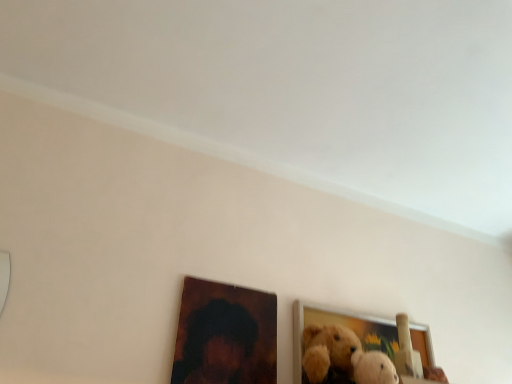
This screenshot has height=384, width=512. Describe the element at coordinates (225, 335) in the screenshot. I see `wooden picture frame at lower center, arranged as the first picture frame when viewed from the left` at that location.

Image resolution: width=512 pixels, height=384 pixels. What are the coordinates of `wooden picture frame at lower center, arranged as the first picture frame when viewed from the left` in the screenshot? It's located at (225, 335).

From the picture: What is the approximate width of wooden picture frame at lower right, positioned as the 2th picture frame in left-to-right order?

The width of wooden picture frame at lower right, positioned as the 2th picture frame in left-to-right order, is 4.57 centimeters.

Where is `wooden picture frame at lower right, positioned as the 2th picture frame in left-to-right order`? The image size is (512, 384). wooden picture frame at lower right, positioned as the 2th picture frame in left-to-right order is located at coordinates pos(338,339).

Based on the photo, measure the distance between wooden picture frame at lower right, positioned as the 2th picture frame in left-to-right order, and camera.

The distance of wooden picture frame at lower right, positioned as the 2th picture frame in left-to-right order, from camera is 35.41 inches.

What do you see at coordinates (338, 339) in the screenshot? The width and height of the screenshot is (512, 384). I see `wooden picture frame at lower right, positioned as the 2th picture frame in left-to-right order` at bounding box center [338, 339].

This screenshot has width=512, height=384. I want to click on wooden picture frame at lower center, the 2th picture frame when ordered from right to left, so click(x=225, y=335).

Is wooden picture frame at lower right, which is the 1th picture frame from right to left, at the right side of wooden picture frame at lower center, the 2th picture frame when ordered from right to left?

Yes.

Who is more distant, wooden picture frame at lower right, which is the 1th picture frame from right to left, or wooden picture frame at lower center, the 2th picture frame when ordered from right to left?

wooden picture frame at lower right, which is the 1th picture frame from right to left, is further away from the camera.

Considering the points (412, 335) and (210, 355), which point is behind, point (412, 335) or point (210, 355)?

The point (412, 335) is behind.

From the image's perspective, would you say wooden picture frame at lower right, positioned as the 2th picture frame in left-to-right order, is shown under wooden picture frame at lower center, arranged as the first picture frame when viewed from the left?

Indeed, from the image's perspective, wooden picture frame at lower right, positioned as the 2th picture frame in left-to-right order, is shown beneath wooden picture frame at lower center, arranged as the first picture frame when viewed from the left.

From a real-world perspective, is wooden picture frame at lower right, which is the 1th picture frame from right to left, positioned above or below wooden picture frame at lower center, arranged as the first picture frame when viewed from the left?

wooden picture frame at lower right, which is the 1th picture frame from right to left, is below wooden picture frame at lower center, arranged as the first picture frame when viewed from the left.

Is wooden picture frame at lower right, positioned as the 2th picture frame in left-to-right order, thinner than wooden picture frame at lower center, arranged as the first picture frame when viewed from the left?

Incorrect, the width of wooden picture frame at lower right, positioned as the 2th picture frame in left-to-right order, is not less than that of wooden picture frame at lower center, arranged as the first picture frame when viewed from the left.

Is wooden picture frame at lower right, which is the 1th picture frame from right to left, shorter than wooden picture frame at lower center, arranged as the first picture frame when viewed from the left?

Incorrect, the height of wooden picture frame at lower right, which is the 1th picture frame from right to left, does not fall short of that of wooden picture frame at lower center, arranged as the first picture frame when viewed from the left.

In the scene shown: Is wooden picture frame at lower right, positioned as the 2th picture frame in left-to-right order, bigger than wooden picture frame at lower center, arranged as the first picture frame when viewed from the left?

Correct, wooden picture frame at lower right, positioned as the 2th picture frame in left-to-right order, is larger in size than wooden picture frame at lower center, arranged as the first picture frame when viewed from the left.

In the scene shown: Is wooden picture frame at lower right, positioned as the 2th picture frame in left-to-right order, located outside wooden picture frame at lower center, the 2th picture frame when ordered from right to left?

Absolutely, wooden picture frame at lower right, positioned as the 2th picture frame in left-to-right order, is external to wooden picture frame at lower center, the 2th picture frame when ordered from right to left.

Can you see wooden picture frame at lower right, positioned as the 2th picture frame in left-to-right order, touching wooden picture frame at lower center, arranged as the first picture frame when viewed from the left?

There is a gap between wooden picture frame at lower right, positioned as the 2th picture frame in left-to-right order, and wooden picture frame at lower center, arranged as the first picture frame when viewed from the left.

Is wooden picture frame at lower right, positioned as the 2th picture frame in left-to-right order, oriented towards wooden picture frame at lower center, arranged as the first picture frame when viewed from the left?

No, wooden picture frame at lower right, positioned as the 2th picture frame in left-to-right order, is not turned towards wooden picture frame at lower center, arranged as the first picture frame when viewed from the left.

Can you tell me how much wooden picture frame at lower right, which is the 1th picture frame from right to left, and wooden picture frame at lower center, the 2th picture frame when ordered from right to left, differ in facing direction?

The angular difference between wooden picture frame at lower right, which is the 1th picture frame from right to left, and wooden picture frame at lower center, the 2th picture frame when ordered from right to left, is 1.1 degrees.

Where is `picture frame to the left of wooden picture frame at lower right, positioned as the 2th picture frame in left-to-right order`? The image size is (512, 384). picture frame to the left of wooden picture frame at lower right, positioned as the 2th picture frame in left-to-right order is located at coordinates (225, 335).

Does wooden picture frame at lower center, arranged as the first picture frame when viewed from the left, appear on the left side of wooden picture frame at lower right, positioned as the 2th picture frame in left-to-right order?

Correct, you'll find wooden picture frame at lower center, arranged as the first picture frame when viewed from the left, to the left of wooden picture frame at lower right, positioned as the 2th picture frame in left-to-right order.

Is wooden picture frame at lower center, the 2th picture frame when ordered from right to left, closer to camera compared to wooden picture frame at lower right, positioned as the 2th picture frame in left-to-right order?

Yes, wooden picture frame at lower center, the 2th picture frame when ordered from right to left, is in front of wooden picture frame at lower right, positioned as the 2th picture frame in left-to-right order.

Is point (228, 310) in front of point (324, 339)?

No, it is behind (324, 339).

From the image's perspective, does wooden picture frame at lower center, the 2th picture frame when ordered from right to left, appear lower than wooden picture frame at lower right, positioned as the 2th picture frame in left-to-right order?

Actually, wooden picture frame at lower center, the 2th picture frame when ordered from right to left, appears above wooden picture frame at lower right, positioned as the 2th picture frame in left-to-right order, in the image.

From a real-world perspective, which is physically above, wooden picture frame at lower center, the 2th picture frame when ordered from right to left, or wooden picture frame at lower right, which is the 1th picture frame from right to left?

wooden picture frame at lower center, the 2th picture frame when ordered from right to left.

Which object is thinner, wooden picture frame at lower center, arranged as the first picture frame when viewed from the left, or wooden picture frame at lower right, positioned as the 2th picture frame in left-to-right order?

With smaller width is wooden picture frame at lower center, arranged as the first picture frame when viewed from the left.

From the picture: Which of these two, wooden picture frame at lower center, arranged as the first picture frame when viewed from the left, or wooden picture frame at lower right, positioned as the 2th picture frame in left-to-right order, stands taller?

With more height is wooden picture frame at lower right, positioned as the 2th picture frame in left-to-right order.

Based on the photo, considering the relative sizes of wooden picture frame at lower center, arranged as the first picture frame when viewed from the left, and wooden picture frame at lower right, which is the 1th picture frame from right to left, in the image provided, is wooden picture frame at lower center, arranged as the first picture frame when viewed from the left, smaller than wooden picture frame at lower right, which is the 1th picture frame from right to left,?

Indeed, wooden picture frame at lower center, arranged as the first picture frame when viewed from the left, has a smaller size compared to wooden picture frame at lower right, which is the 1th picture frame from right to left.

Does wooden picture frame at lower center, the 2th picture frame when ordered from right to left, contain wooden picture frame at lower right, positioned as the 2th picture frame in left-to-right order?

No.

Is wooden picture frame at lower center, the 2th picture frame when ordered from right to left, far away from wooden picture frame at lower right, positioned as the 2th picture frame in left-to-right order?

No, there isn't a large distance between wooden picture frame at lower center, the 2th picture frame when ordered from right to left, and wooden picture frame at lower right, positioned as the 2th picture frame in left-to-right order.

Is wooden picture frame at lower center, arranged as the first picture frame when viewed from the left, oriented towards wooden picture frame at lower right, positioned as the 2th picture frame in left-to-right order?

No, wooden picture frame at lower center, arranged as the first picture frame when viewed from the left, is not oriented towards wooden picture frame at lower right, positioned as the 2th picture frame in left-to-right order.

How different are the orientations of wooden picture frame at lower center, the 2th picture frame when ordered from right to left, and wooden picture frame at lower right, positioned as the 2th picture frame in left-to-right order, in degrees?

They differ by 1.1 degrees in their facing directions.

Locate an element on the screen. Image resolution: width=512 pixels, height=384 pixels. picture frame that appears above the wooden picture frame at lower right, positioned as the 2th picture frame in left-to-right order (from the image's perspective) is located at coordinates (225, 335).

The image size is (512, 384). I want to click on picture frame above the wooden picture frame at lower right, which is the 1th picture frame from right to left (from a real-world perspective), so click(x=225, y=335).

In the image, there is a wooden picture frame at lower center, arranged as the first picture frame when viewed from the left. Identify the location of picture frame below it (from the image's perspective). (338, 339).